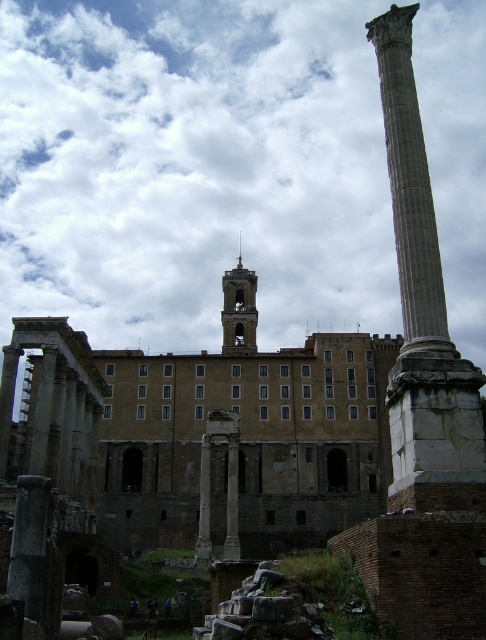
Question: Is gray stone column at right bigger than smooth stone tower at center?

Choices:
 (A) yes
 (B) no

Answer: (A)

Question: Is gray stone column at right to the left of smooth stone tower at center from the viewer's perspective?

Choices:
 (A) yes
 (B) no

Answer: (B)

Question: Does gray stone column at right come behind smooth stone tower at center?

Choices:
 (A) no
 (B) yes

Answer: (A)